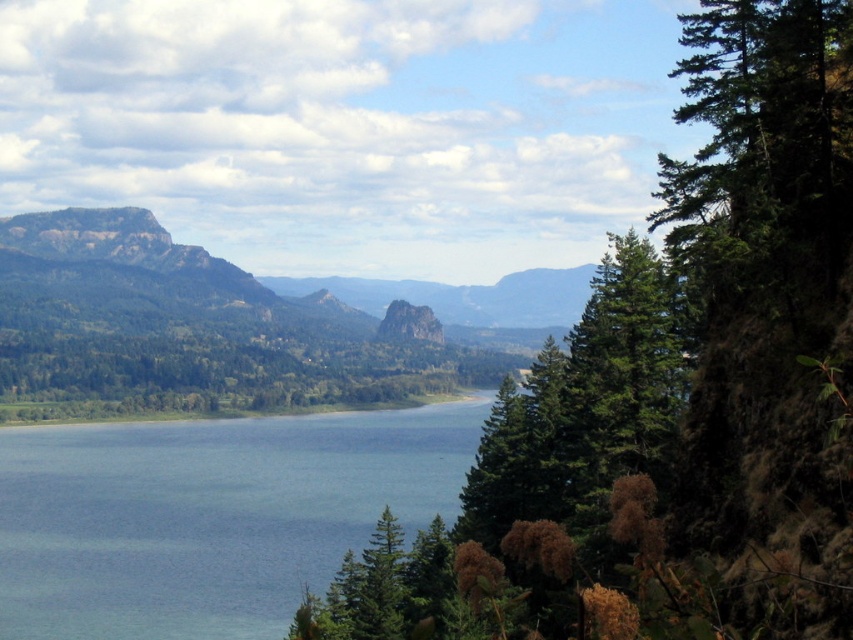
Question: Which point appears farthest from the camera in this image?

Choices:
 (A) (695, 456)
 (B) (234, 582)

Answer: (B)

Question: Among these objects, which one is farthest from the camera?

Choices:
 (A) green textured tree at right
 (B) blue water at center

Answer: (B)

Question: Can you confirm if green textured tree at right is positioned to the right of blue water at center?

Choices:
 (A) no
 (B) yes

Answer: (B)

Question: Can you confirm if green textured tree at right is positioned above blue water at center?

Choices:
 (A) no
 (B) yes

Answer: (B)

Question: Is green textured tree at right behind blue water at center?

Choices:
 (A) no
 (B) yes

Answer: (A)